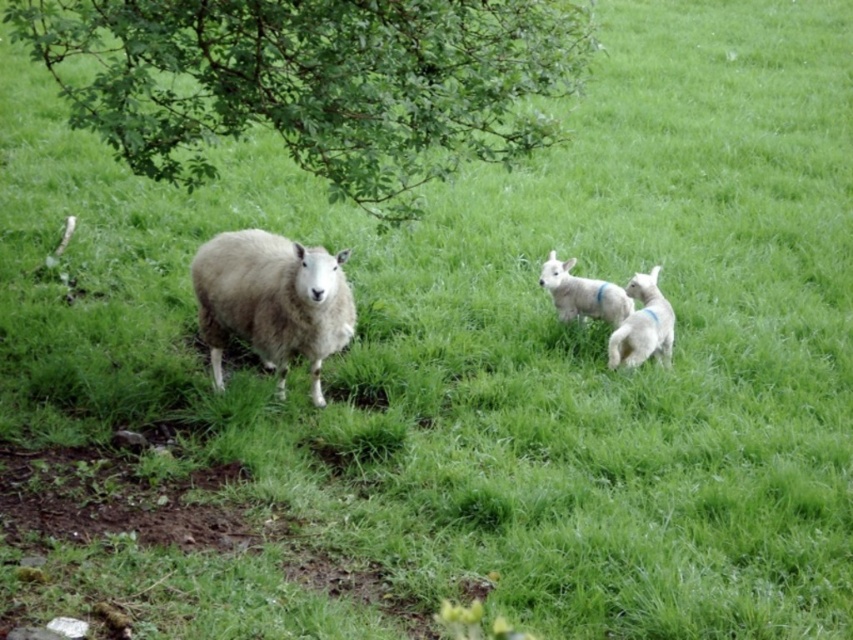
You are standing in the field where the sheep and lambs are grazing. If you look towards the upper left corner of your view, where exactly would you see the green leafy tree at upper left?

The green leafy tree at upper left is located at the coordinate point of 0.130 on the x axis and 0.368 on the y axis.

You are a photographer trying to capture a photo of the white woolen lamb at right. You are currently standing near the green leafy tree at upper left. Which direction should you move to get a better shot of the lamb?

The green leafy tree at upper left is positioned on the left side of the white woolen lamb at right, so you should move to the right to get a better shot of the white woolen lamb at right.

You are a photographer trying to capture the white woolly sheep at center and the green leafy tree at upper left in the same frame. Based on their positions, which object is closer to the right edge of the image?

The green leafy tree at upper left is positioned on the right side of the white woolly sheep at center, so the green leafy tree at upper left is closer to the right edge of the image.